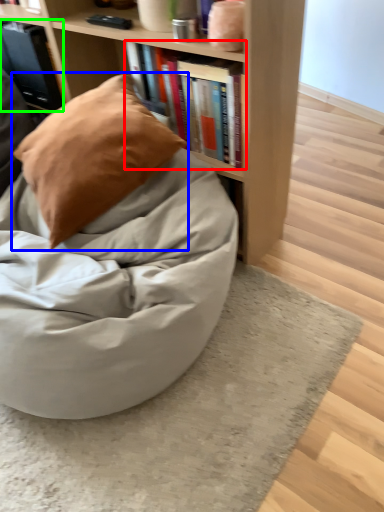
Question: Which object is the farthest from book (highlighted by a red box)? Choose among these: pillow (highlighted by a blue box) or book (highlighted by a green box).

Choices:
 (A) pillow
 (B) book

Answer: (B)